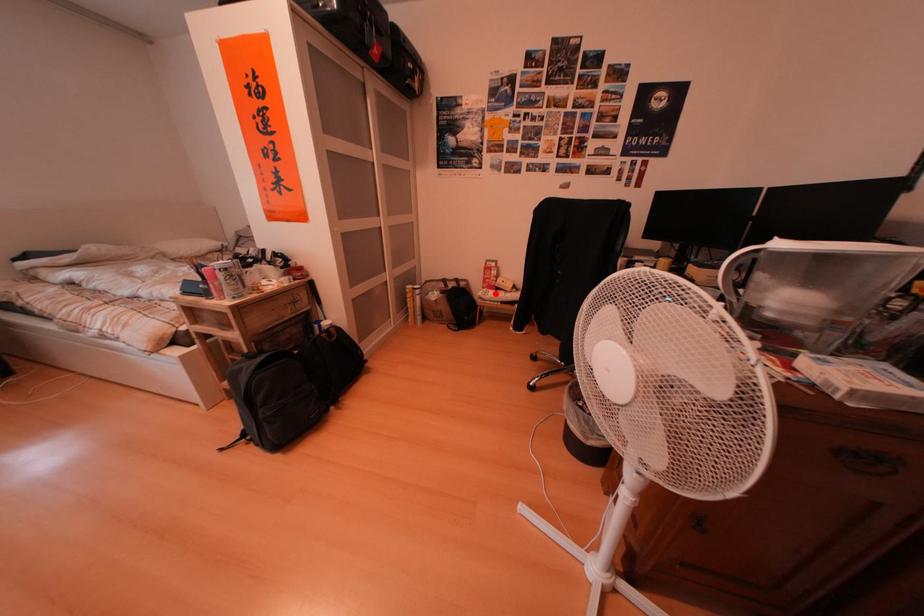
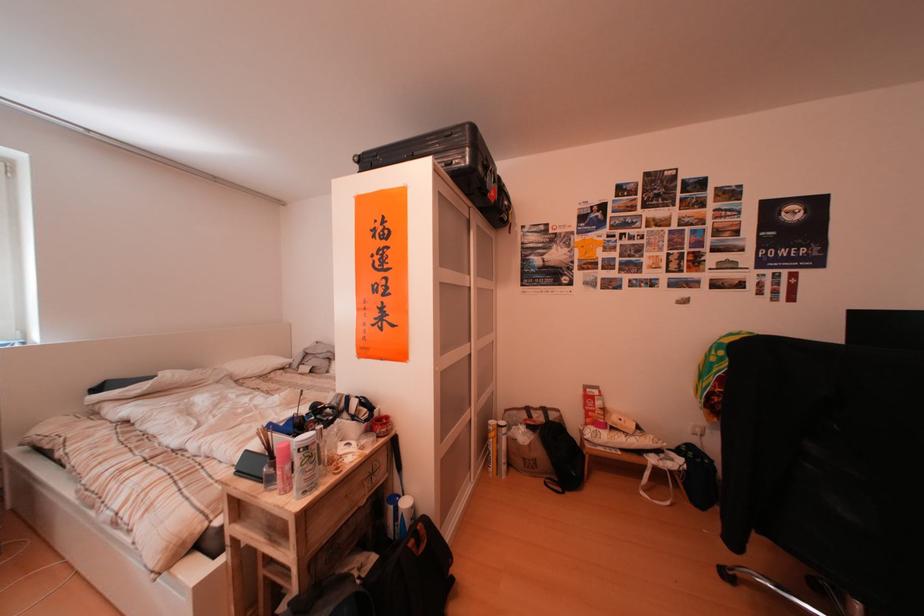
Find the pixel in the second image that matches the highlighted location in the first image.

(599, 430)